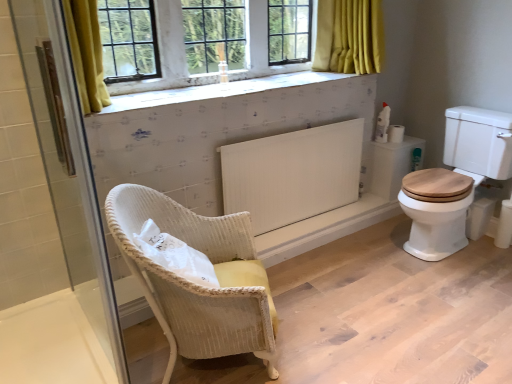
What do you see at coordinates (350, 37) in the screenshot? The height and width of the screenshot is (384, 512). I see `white painted wood at upper center` at bounding box center [350, 37].

Measure the distance between woven yellow chair at center and camera.

The depth of woven yellow chair at center is 4.78 feet.

The image size is (512, 384). What do you see at coordinates (383, 124) in the screenshot?
I see `white plastic spray bottle at upper right` at bounding box center [383, 124].

The height and width of the screenshot is (384, 512). What do you see at coordinates (50, 217) in the screenshot?
I see `transparent glass shower door at left` at bounding box center [50, 217].

Find the location of a particular element. white textured tile at upper center is located at coordinates (219, 90).

Is white plastic spray bottle at upper right in front of or behind white matte radiator at center in the image?

Clearly, white plastic spray bottle at upper right is behind white matte radiator at center.

Are white plastic spray bottle at upper right and white matte radiator at center located far from each other?

No, white plastic spray bottle at upper right is not far from white matte radiator at center.

Considering the sizes of objects white plastic spray bottle at upper right and white matte radiator at center in the image provided, who is smaller, white plastic spray bottle at upper right or white matte radiator at center?

white plastic spray bottle at upper right.

From a real-world perspective, is white textured tile at upper center physically located above or below transparent glass shower door at left?

From a real-world perspective, white textured tile at upper center is physically above transparent glass shower door at left.

There is a transparent glass shower door at left. Identify the location of window sill above it (from a real-world perspective). This screenshot has width=512, height=384. pyautogui.click(x=219, y=90).

Is white textured tile at upper center placed right next to transparent glass shower door at left?

No, white textured tile at upper center is not making contact with transparent glass shower door at left.

Considering the sizes of objects white textured tile at upper center and transparent glass shower door at left in the image provided, who is smaller, white textured tile at upper center or transparent glass shower door at left?

With smaller size is transparent glass shower door at left.

Find the location of `screen door in front of the white plastic spray bottle at upper right`. screen door in front of the white plastic spray bottle at upper right is located at coordinates point(50,217).

Is transparent glass shower door at left at the back of white plastic spray bottle at upper right?

No.

From a real-world perspective, is white plastic spray bottle at upper right positioned over transparent glass shower door at left based on gravity?

No, from a real-world perspective, white plastic spray bottle at upper right is not above transparent glass shower door at left.

Considering the sizes of objects white plastic spray bottle at upper right and transparent glass shower door at left in the image provided, who is taller, white plastic spray bottle at upper right or transparent glass shower door at left?

transparent glass shower door at left is taller.

Does white painted wood at upper center have a greater height compared to white wicker rocking chair at right?

No, white painted wood at upper center is not taller than white wicker rocking chair at right.

Is white painted wood at upper center wider than white wicker rocking chair at right?

No.

Can you see white painted wood at upper center touching white wicker rocking chair at right?

No, white painted wood at upper center is not beside white wicker rocking chair at right.

Is white painted wood at upper center oriented towards white wicker rocking chair at right?

No, white painted wood at upper center is not aimed at white wicker rocking chair at right.

Which is behind, woven yellow chair at center or white textured tile at upper center?

Positioned behind is white textured tile at upper center.

From the image's perspective, which is above, woven yellow chair at center or white textured tile at upper center?

white textured tile at upper center.

Is woven yellow chair at center looking in the opposite direction of white textured tile at upper center?

woven yellow chair at center does not have its back to white textured tile at upper center.

Considering the positions of points (236, 308) and (148, 94), is point (236, 308) farther from camera compared to point (148, 94)?

No, it is in front of (148, 94).

From the image's perspective, relative to white matte toilet paper at right, is white plastic spray bottle at upper right above or below?

Based on their image positions, white plastic spray bottle at upper right is located above white matte toilet paper at right.

Is white plastic spray bottle at upper right not inside white matte toilet paper at right?

Indeed, white plastic spray bottle at upper right is completely outside white matte toilet paper at right.

Is white plastic spray bottle at upper right facing away from white matte toilet paper at right?

No, white plastic spray bottle at upper right is not facing the opposite direction of white matte toilet paper at right.

In the scene shown: Based on their positions, is white plastic spray bottle at upper right located to the left or right of white matte toilet paper at right?

Clearly, white plastic spray bottle at upper right is on the left of white matte toilet paper at right in the image.

Are white painted wood at upper center and white plastic spray bottle at upper right beside each other?

No, white painted wood at upper center is not next to white plastic spray bottle at upper right.

Locate an element on the screen. This screenshot has height=384, width=512. toiletries directly beneath the white painted wood at upper center (from a real-world perspective) is located at coordinates (383, 124).

From the image's perspective, is white painted wood at upper center above or below white plastic spray bottle at upper right?

Based on their image positions, white painted wood at upper center is located above white plastic spray bottle at upper right.

Find the location of a particular element. toiletries above the white matte radiator at center (from a real-world perspective) is located at coordinates (383, 124).

This screenshot has width=512, height=384. Identify the location of screen door that is below the white textured tile at upper center (from the image's perspective). (50, 217).

From the image, which object appears to be farther from white painted wood at upper center, white matte toilet paper at right or white plastic spray bottle at upper right?

white matte toilet paper at right is positioned further to the anchor white painted wood at upper center.

Based on their spatial positions, is white matte radiator at center or white wicker rocking chair at right further from white painted wood at upper center?

Among the two, white wicker rocking chair at right is located further to white painted wood at upper center.

Which object lies further to the anchor point white matte toilet paper at right, white matte radiator at center or white textured tile at upper center?

white textured tile at upper center lies further to white matte toilet paper at right than the other object.

Looking at the image, which one is located closer to transparent glass shower door at left, woven yellow chair at center or white matte toilet paper at right?

woven yellow chair at center lies closer to transparent glass shower door at left than the other object.

When comparing their distances from transparent glass shower door at left, does white matte toilet paper at right or white wicker rocking chair at right seem further?

white matte toilet paper at right is positioned further to the anchor transparent glass shower door at left.

From the image, which object appears to be nearer to woven yellow chair at center, white matte toilet paper at right or white wicker rocking chair at right?

Based on the image, white wicker rocking chair at right appears to be nearer to woven yellow chair at center.

Based on their spatial positions, is woven yellow chair at center or white painted wood at upper center further from white textured tile at upper center?

Based on the image, woven yellow chair at center appears to be further to white textured tile at upper center.

From the image, which object appears to be nearer to white matte radiator at center, white plastic spray bottle at upper right or transparent glass shower door at left?

white plastic spray bottle at upper right is closer to white matte radiator at center.

The height and width of the screenshot is (384, 512). I want to click on toiletries between white wicker rocking chair at right and white matte toilet paper at right in the front-back direction, so click(x=383, y=124).

Where is `screen door between white textured tile at upper center and woven yellow chair at center in the up-down direction`? The height and width of the screenshot is (384, 512). screen door between white textured tile at upper center and woven yellow chair at center in the up-down direction is located at coordinates (50, 217).

Locate an element on the screen. toiletries between white textured tile at upper center and white wicker rocking chair at right is located at coordinates (383, 124).

At what (x,y) coordinates should I click in order to perform the action: click on window sill between transparent glass shower door at left and white plastic spray bottle at upper right in the front-back direction. Please return your answer as a coordinate pair (x, y). The width and height of the screenshot is (512, 384). Looking at the image, I should click on (219, 90).